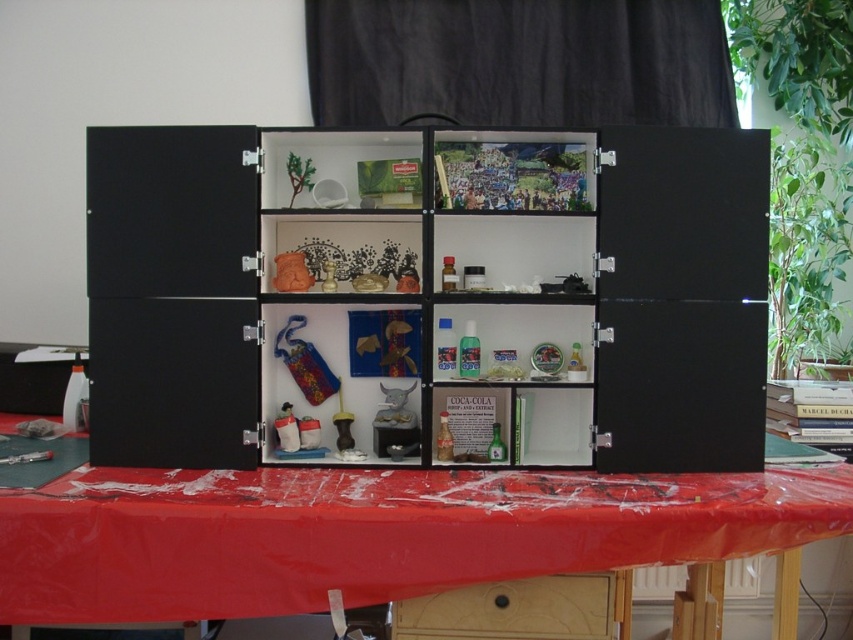
Question: Considering the relative positions of red plastic table at center and matte orange vase at center in the image provided, where is red plastic table at center located with respect to matte orange vase at center?

Choices:
 (A) right
 (B) left

Answer: (A)

Question: Among these objects, which one is nearest to the camera?

Choices:
 (A) wooden drawer at lower center
 (B) red plastic table at center
 (C) translucent plastic bottles at center

Answer: (B)

Question: Does wooden drawer at lower center appear on the left side of translucent plastic bottles at center?

Choices:
 (A) no
 (B) yes

Answer: (B)

Question: Which object is farther from the camera taking this photo?

Choices:
 (A) matte orange vase at center
 (B) black matte cabinet at center
 (C) wooden drawer at lower center

Answer: (A)

Question: Is red plastic table at center bigger than translucent plastic bottles at center?

Choices:
 (A) yes
 (B) no

Answer: (A)

Question: Which point is closer to the camera taking this photo?

Choices:
 (A) (584, 348)
 (B) (560, 577)

Answer: (B)